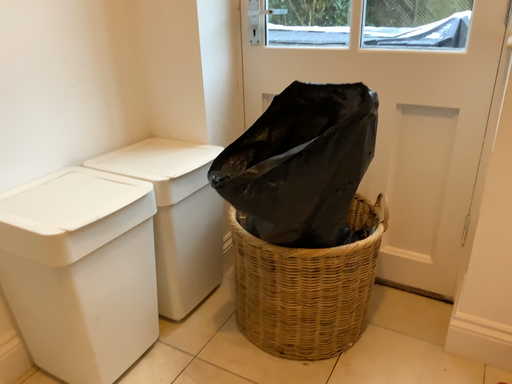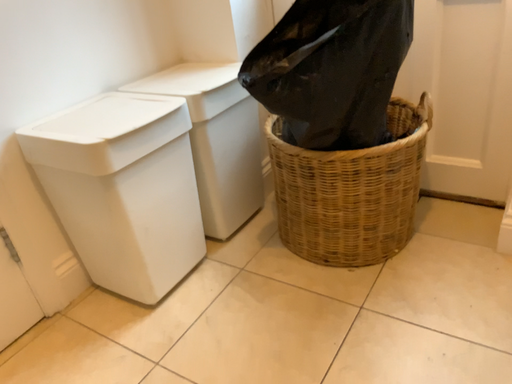
Question: Which way did the camera rotate in the video?

Choices:
 (A) rotated downward
 (B) rotated upward

Answer: (A)